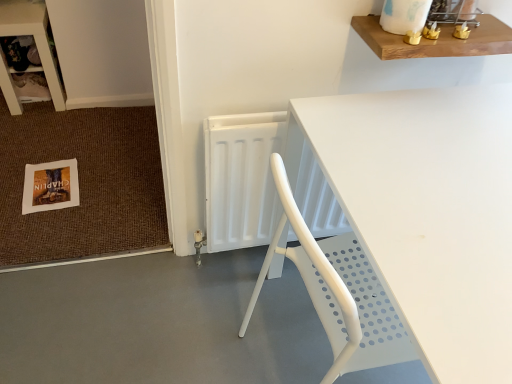
The image size is (512, 384). Describe the element at coordinates (240, 178) in the screenshot. I see `white plastic radiator at center` at that location.

Locate an element on the screen. wooden shelf at upper right is located at coordinates (437, 40).

What is the approximate height of gray smooth concrete at lower left?

gray smooth concrete at lower left is 2.21 inches tall.

Describe the element at coordinates (82, 183) in the screenshot. The width and height of the screenshot is (512, 384). I see `white paper doormat at lower left` at that location.

The width and height of the screenshot is (512, 384). Identify the location of white paper postcard at lower left. (50, 186).

Where is `white plastic table at center`? white plastic table at center is located at coordinates (420, 211).

I want to click on white plastic radiator at center, so click(x=240, y=178).

How many degrees apart are the facing directions of wooden shelf at upper right and white paper postcard at lower left?

The facing directions of wooden shelf at upper right and white paper postcard at lower left are 6.2 degrees apart.

Is wooden shelf at upper right far away from white paper postcard at lower left?

Indeed, wooden shelf at upper right is not near white paper postcard at lower left.

How far apart are wooden shelf at upper right and white paper postcard at lower left?

wooden shelf at upper right and white paper postcard at lower left are 4.54 feet apart.

Is wooden shelf at upper right looking in the opposite direction of white paper postcard at lower left?

No.

Who is shorter, white paper postcard at lower left or white plastic table at center?

With less height is white paper postcard at lower left.

Would you say white plastic table at center is part of white paper postcard at lower left's contents?

No, white paper postcard at lower left does not contain white plastic table at center.

Based on their sizes in the image, would you say white paper postcard at lower left is bigger or smaller than white plastic table at center?

Clearly, white paper postcard at lower left is smaller in size than white plastic table at center.

Does point (205, 174) appear closer or farther from the camera than point (53, 203)?

Point (205, 174).

Considering the sizes of white plastic radiator at center and white paper postcard at lower left in the image, is white plastic radiator at center wider or thinner than white paper postcard at lower left?

Clearly, white plastic radiator at center has less width compared to white paper postcard at lower left.

Is white plastic radiator at center positioned with its back to white paper postcard at lower left?

That's not correct — white plastic radiator at center is not looking away from white paper postcard at lower left.

Does white plastic radiator at center have a larger size compared to white paper postcard at lower left?

Yes, white plastic radiator at center is bigger than white paper postcard at lower left.

Is white paper doormat at lower left thinner than white plastic radiator at center?

In fact, white paper doormat at lower left might be wider than white plastic radiator at center.

Does white paper doormat at lower left have a greater height compared to white plastic radiator at center?

No, white paper doormat at lower left is not taller than white plastic radiator at center.

From the picture: From a real-world perspective, between white paper doormat at lower left and white plastic radiator at center, who is vertically higher?

white plastic radiator at center is physically above.

Visually, is white plastic table at center positioned to the left or to the right of gray smooth concrete at lower left?

white plastic table at center is to the right of gray smooth concrete at lower left.

Can you confirm if white plastic table at center is shorter than gray smooth concrete at lower left?

In fact, white plastic table at center may be taller than gray smooth concrete at lower left.

Does point (402, 92) appear closer or farther from the camera than point (322, 346)?

Point (402, 92) is closer to the camera than point (322, 346).

Consider the image. Is gray smooth concrete at lower left inside white plastic table at center?

Definitely not — gray smooth concrete at lower left is not inside white plastic table at center.

Between wooden shelf at upper left and white paper postcard at lower left, which one has less height?

white paper postcard at lower left is shorter.

Is wooden shelf at upper left turned away from white paper postcard at lower left?

wooden shelf at upper left does not have its back to white paper postcard at lower left.

From a real-world perspective, does wooden shelf at upper left stand above white paper postcard at lower left?

Indeed, from a real-world perspective, wooden shelf at upper left stands above white paper postcard at lower left.

Is wooden shelf at upper left in front of white paper postcard at lower left?

No, it is behind white paper postcard at lower left.

From the image's perspective, which one is positioned higher, wooden shelf at upper right or white plastic table at center?

wooden shelf at upper right, from the image's perspective.

Is wooden shelf at upper right oriented towards white plastic table at center?

No, wooden shelf at upper right is not oriented towards white plastic table at center.

Between wooden shelf at upper right and white plastic table at center, which one has smaller width?

wooden shelf at upper right is thinner.

Are wooden shelf at upper right and white plastic table at center making contact?

No, wooden shelf at upper right is not next to white plastic table at center.

The width and height of the screenshot is (512, 384). What are the coordinates of `postcard located behind the wooden shelf at upper right` in the screenshot? It's located at (50, 186).

In the image, there is a white plastic table at center. In order to click on postcard below it (from a real-world perspective) in this screenshot , I will do `click(50, 186)`.

When comparing their distances from white paper postcard at lower left, does gray smooth concrete at lower left or white plastic table at center seem closer?

gray smooth concrete at lower left lies closer to white paper postcard at lower left than the other object.

Considering their positions, is wooden shelf at upper left positioned closer to wooden shelf at upper right than white plastic radiator at center?

white plastic radiator at center.

Considering their positions, is white paper doormat at lower left positioned further to wooden shelf at upper left than white plastic table at center?

white plastic table at center is further to wooden shelf at upper left.

From the image, which object appears to be nearer to white paper doormat at lower left, white paper postcard at lower left or gray smooth concrete at lower left?

white paper postcard at lower left is positioned closer to the anchor white paper doormat at lower left.

Based on their spatial positions, is white plastic table at center or white paper doormat at lower left further from wooden shelf at upper right?

white paper doormat at lower left is positioned further to the anchor wooden shelf at upper right.

From the image, which object appears to be farther from wooden shelf at upper left, white plastic table at center or wooden shelf at upper right?

white plastic table at center is further to wooden shelf at upper left.

When comparing their distances from white plastic radiator at center, does white paper doormat at lower left or wooden shelf at upper right seem further?

white paper doormat at lower left is further to white plastic radiator at center.

From the image, which object appears to be farther from white paper doormat at lower left, gray smooth concrete at lower left or white plastic table at center?

Among the two, white plastic table at center is located further to white paper doormat at lower left.

Locate an element on the screen. The width and height of the screenshot is (512, 384). concrete located between wooden shelf at upper left and white plastic radiator at center in the left-right direction is located at coordinates click(159, 323).

Locate an element on the screen. The width and height of the screenshot is (512, 384). concrete between white paper postcard at lower left and wooden shelf at upper right from left to right is located at coordinates (159, 323).

The image size is (512, 384). I want to click on concrete between wooden shelf at upper left and wooden shelf at upper right from left to right, so click(x=159, y=323).

Locate an element on the screen. table between white paper postcard at lower left and wooden shelf at upper right from left to right is located at coordinates (420, 211).